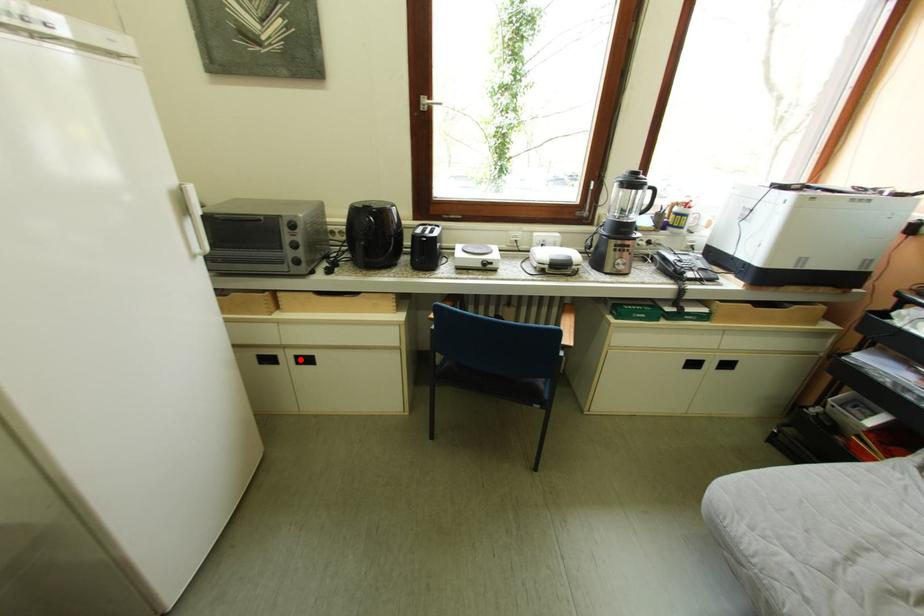
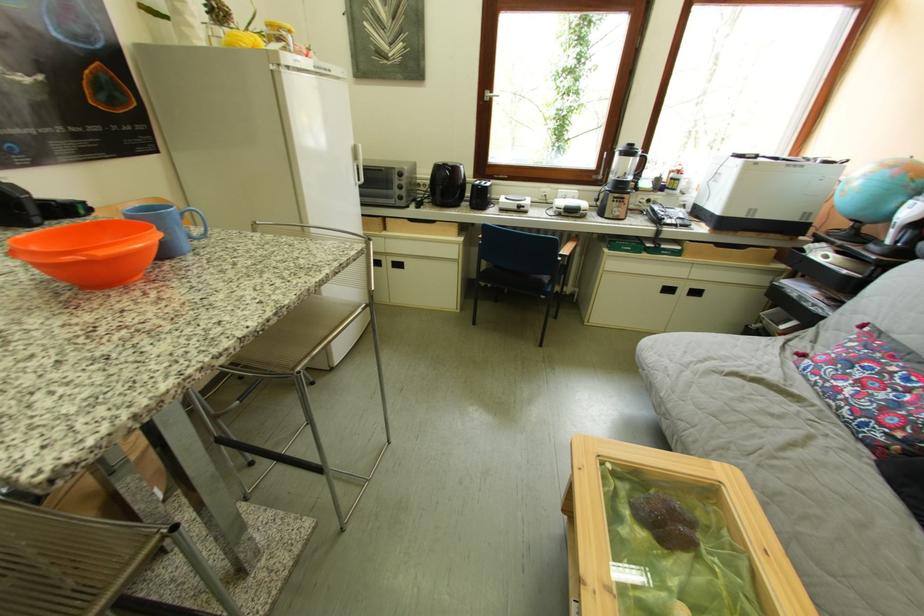
Where in the second image is the point corresponding to the highlighted location from the first image?

(399, 265)